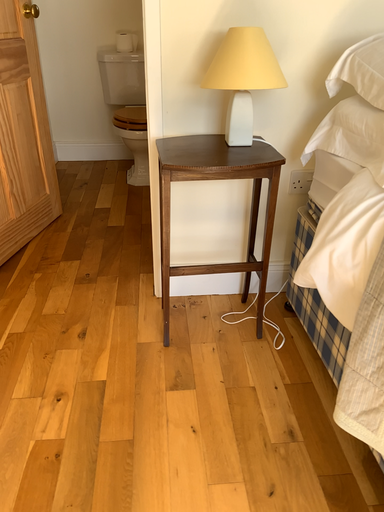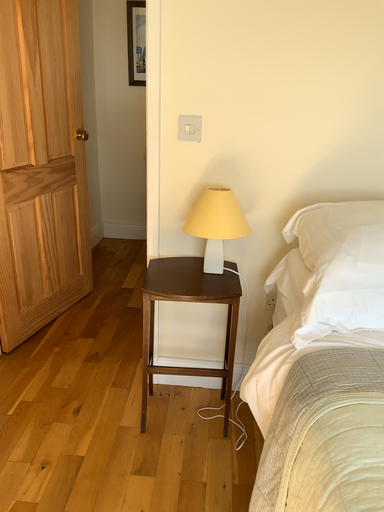
Question: Which way did the camera rotate in the video?

Choices:
 (A) rotated right
 (B) rotated left

Answer: (B)